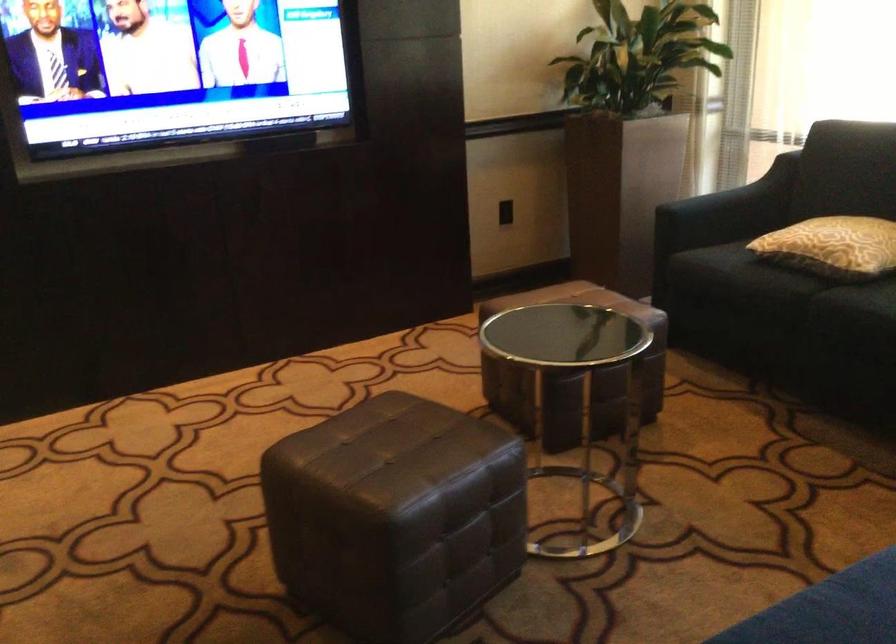
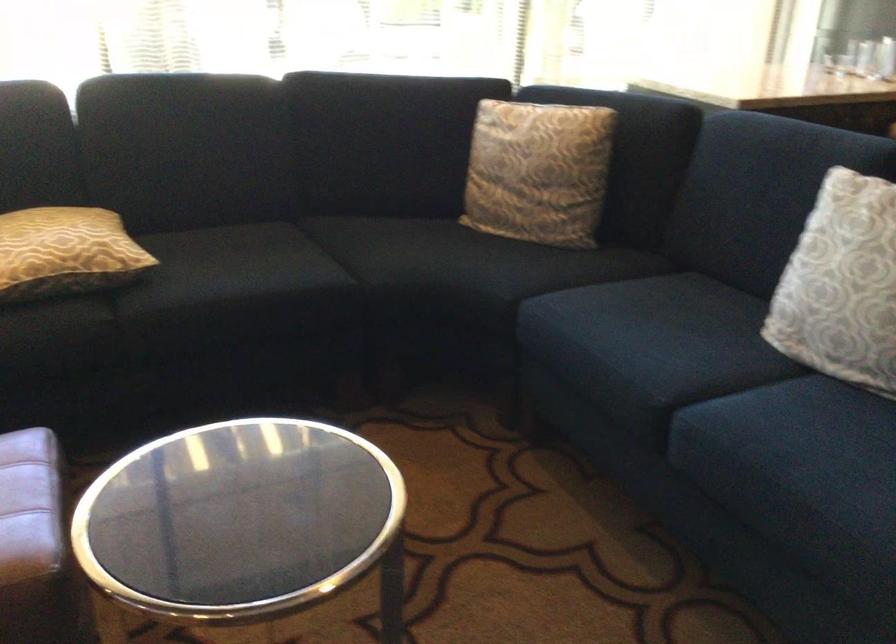
Find the pixel in the second image that matches the point at 816,238 in the first image.

(65, 252)